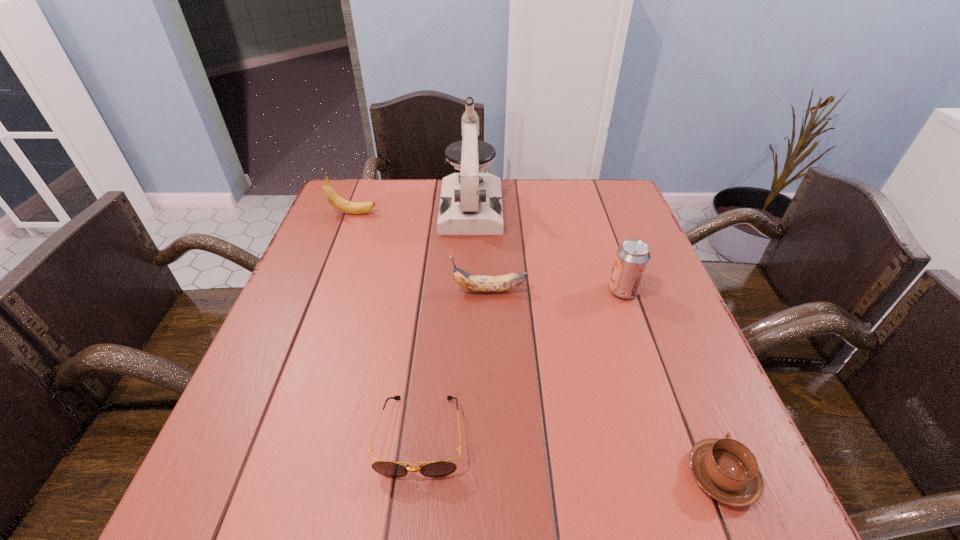
I want to click on microscope, so tap(471, 202).

The height and width of the screenshot is (540, 960). I want to click on the leftmost object, so click(331, 196).

Where is `the farther banana`? The height and width of the screenshot is (540, 960). the farther banana is located at coordinates (331, 196).

The image size is (960, 540). In order to click on beer can in this screenshot , I will do `click(632, 258)`.

At what (x,y) coordinates should I click in order to perform the action: click on the third shortest object. Please return your answer as a coordinate pair (x, y). This screenshot has height=540, width=960. Looking at the image, I should click on (477, 283).

Locate an element on the screen. The width and height of the screenshot is (960, 540). the nearer banana is located at coordinates (477, 283).

Image resolution: width=960 pixels, height=540 pixels. I want to click on cappuccino, so click(727, 470).

What are the coordinates of `sunglasses` in the screenshot? It's located at click(434, 469).

Locate an element on the screen. free point located at the eyepiece of the tallest object is located at coordinates (469, 253).

Find the location of a particular element. vacant space located at the start of the peel on the leftmost object is located at coordinates (408, 213).